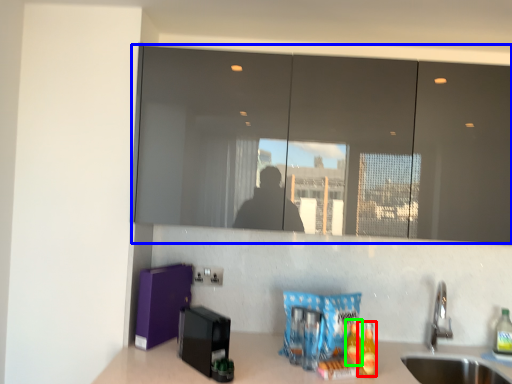
Question: Based on their relative distances, which object is nearer to beverage (highlighted by a red box)? Choose from mirror (highlighted by a blue box) and beverage (highlighted by a green box).

Choices:
 (A) mirror
 (B) beverage

Answer: (B)